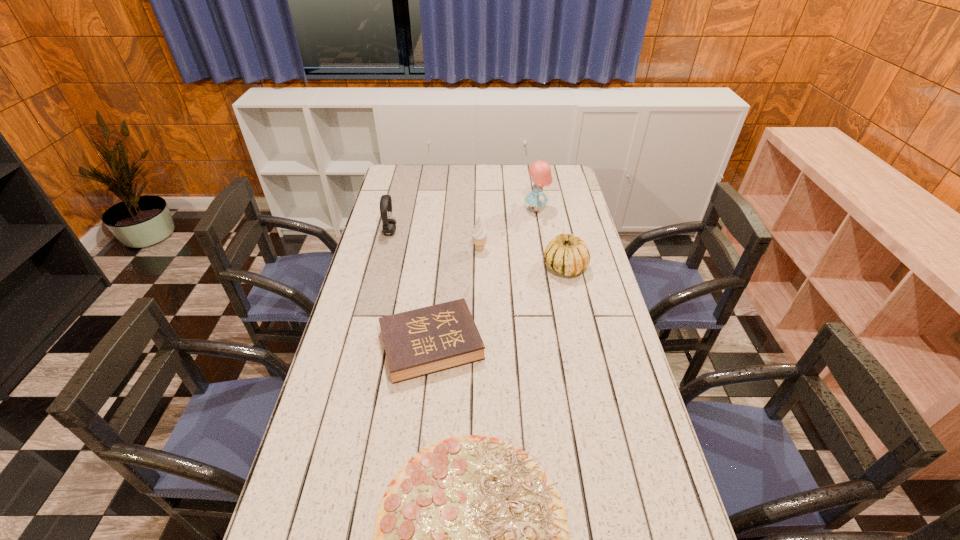
The image size is (960, 540). I want to click on free space located 0.160m on the front-facing side of the icecream, so click(x=480, y=284).

Locate an element on the screen. This screenshot has width=960, height=540. blank area located 0.230m on the left of the gourd is located at coordinates (481, 267).

Identify the location of free space located on the back of the fifth farthest object. The height and width of the screenshot is (540, 960). (438, 283).

The image size is (960, 540). What are the coordinates of `headset positioned at the left edge` in the screenshot? It's located at (389, 224).

Find the location of `hardback book present at the left edge`. hardback book present at the left edge is located at coordinates (419, 342).

Where is `doll that is at the right edge`? The image size is (960, 540). doll that is at the right edge is located at coordinates (540, 171).

What are the coordinates of `gourd that is at the right edge` in the screenshot? It's located at pyautogui.click(x=568, y=254).

Image resolution: width=960 pixels, height=540 pixels. I want to click on free space at the far edge of the desktop, so click(490, 189).

You are a GUI agent. You are given a task and a screenshot of the screen. Output one action in this format:
    pyautogui.click(x=<x>, y=<y>)
    Task: Click on the blank space at the left edge of the desktop
    The height and width of the screenshot is (540, 960).
    Given the screenshot: What is the action you would take?
    pyautogui.click(x=300, y=481)

Where is `blank area at the right edge`? The width and height of the screenshot is (960, 540). blank area at the right edge is located at coordinates (604, 313).